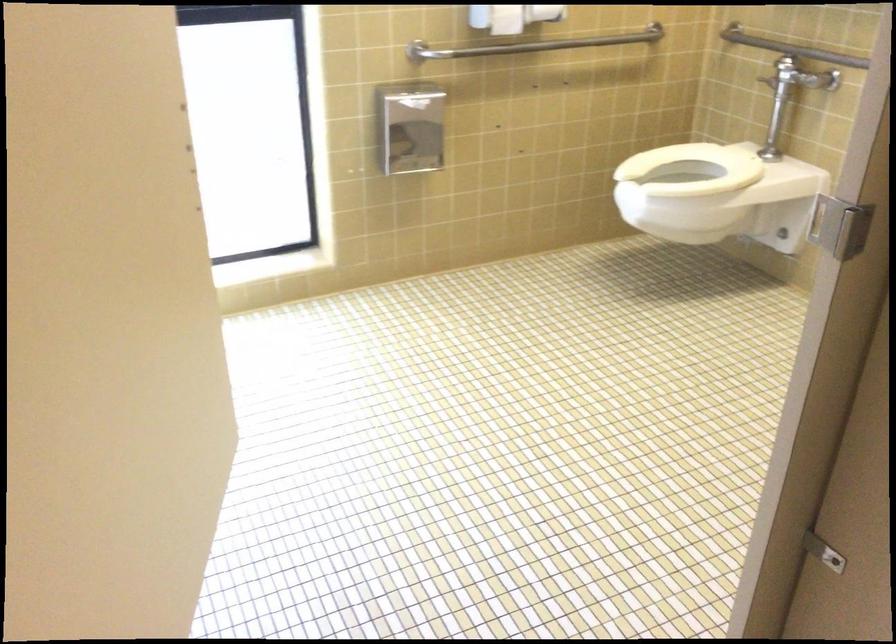
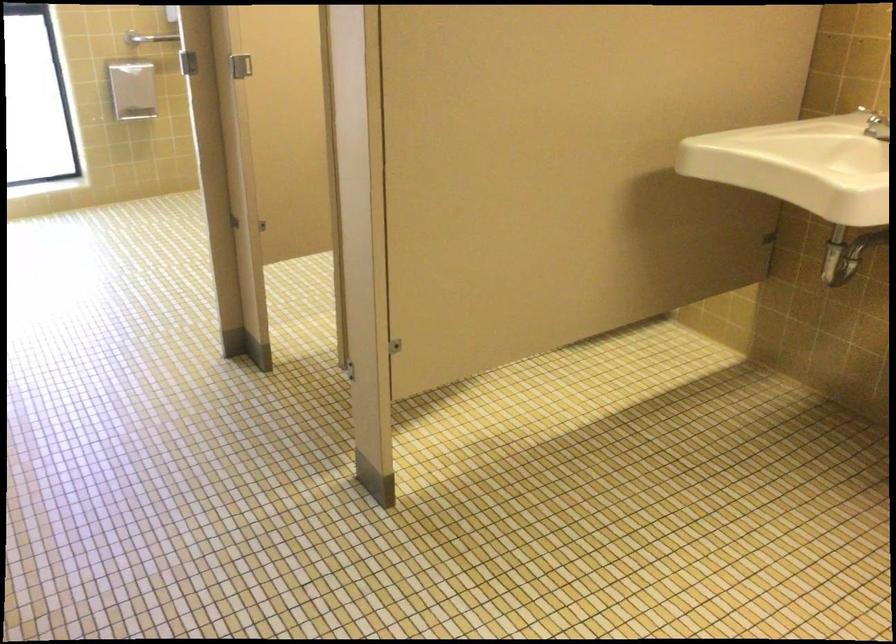
In a continuous first-person perspective shot, in which direction is the camera moving?

A: The cameraman walked toward right, backward.